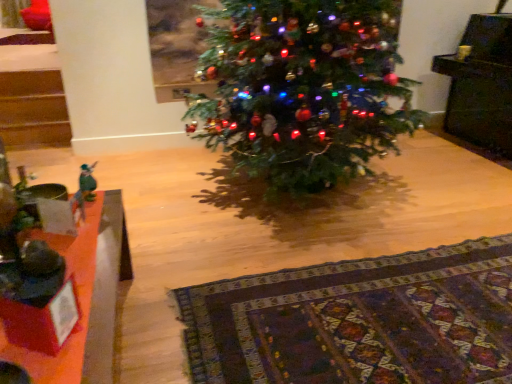
Question: Is green matte christmas tree at center next to green felt angel at left and touching it?

Choices:
 (A) no
 (B) yes

Answer: (A)

Question: From a real-world perspective, is green matte christmas tree at center under green felt angel at left?

Choices:
 (A) yes
 (B) no

Answer: (B)

Question: Is green matte christmas tree at center looking in the opposite direction of green felt angel at left?

Choices:
 (A) no
 (B) yes

Answer: (A)

Question: Can you confirm if green matte christmas tree at center is thinner than green felt angel at left?

Choices:
 (A) yes
 (B) no

Answer: (B)

Question: Can you confirm if green matte christmas tree at center is smaller than green felt angel at left?

Choices:
 (A) yes
 (B) no

Answer: (B)

Question: Can you confirm if green matte christmas tree at center is positioned to the left of green felt angel at left?

Choices:
 (A) yes
 (B) no

Answer: (B)

Question: Does green felt angel at left have a larger size compared to green matte christmas tree at center?

Choices:
 (A) no
 (B) yes

Answer: (A)

Question: Is green felt angel at left outside of green matte christmas tree at center?

Choices:
 (A) yes
 (B) no

Answer: (A)

Question: From a real-world perspective, is green felt angel at left physically below green matte christmas tree at center?

Choices:
 (A) yes
 (B) no

Answer: (A)

Question: Can you confirm if green felt angel at left is taller than green matte christmas tree at center?

Choices:
 (A) yes
 (B) no

Answer: (B)

Question: Can you confirm if green felt angel at left is smaller than green matte christmas tree at center?

Choices:
 (A) no
 (B) yes

Answer: (B)

Question: Could you tell me if green felt angel at left is turned towards green matte christmas tree at center?

Choices:
 (A) yes
 (B) no

Answer: (B)

Question: Is wooden table at lower left taller than patterned wool rug at lower center?

Choices:
 (A) no
 (B) yes

Answer: (B)